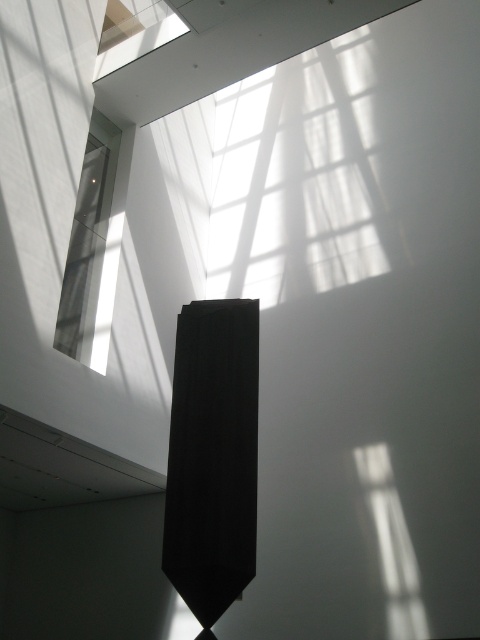
You are an interior designer assessing the space. You need to place a new decorative item on the clear glass window at upper left. Considering the position of the matte black tie at center, which side of the window should you place it to maintain symmetry?

To maintain symmetry, the decorative item should be placed on the left side of the clear glass window at upper left because the matte black tie at center is positioned to the right of the window.

You are standing in the minimalist interior space and want to determine which of the two points, point [183,531] or point [108,262], is nearer to you. Based on the scene, which point is closer?

Point [183,531] is closer to the camera than point [108,262], so it is the closer one.

You are an interior designer planning to hang a new artwork. You see the matte black tie at center and the clear glass window at upper left. Which object is positioned lower in the scene?

The matte black tie at center is located below the clear glass window at upper left, so it is positioned lower in the scene.